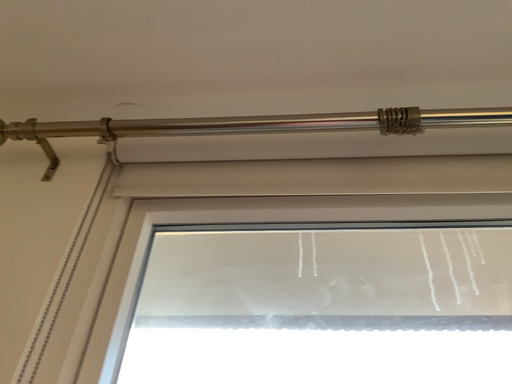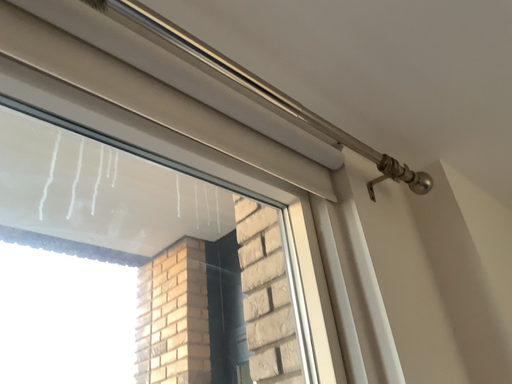
Question: How did the camera likely rotate when shooting the video?

Choices:
 (A) rotated right
 (B) rotated left

Answer: (A)